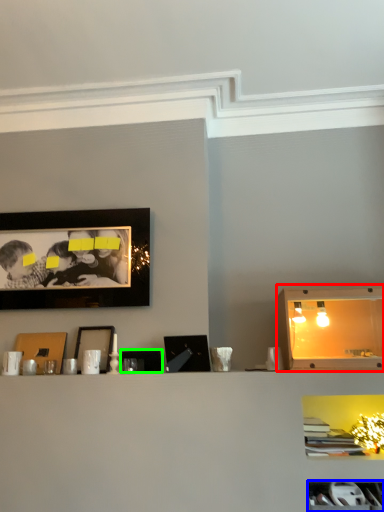
Question: Which object is the farthest from cabinet (highlighted by a red box)? Choose among these: cabinet (highlighted by a blue box) or picture frame (highlighted by a green box).

Choices:
 (A) cabinet
 (B) picture frame

Answer: (B)